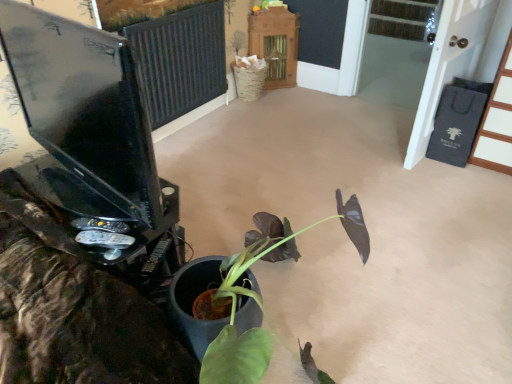
Question: Does wooden cabinet at upper center, arranged as the 2th furniture when viewed from the right, have a greater width compared to black fabric screen door at right?

Choices:
 (A) no
 (B) yes

Answer: (B)

Question: Is wooden cabinet at upper center, arranged as the 2th furniture when viewed from the right, positioned with its back to black fabric screen door at right?

Choices:
 (A) yes
 (B) no

Answer: (B)

Question: Is wooden cabinet at upper center, arranged as the first furniture when viewed from the left, behind black fabric screen door at right?

Choices:
 (A) no
 (B) yes

Answer: (B)

Question: Is wooden cabinet at upper center, arranged as the 2th furniture when viewed from the right, bigger than black fabric screen door at right?

Choices:
 (A) no
 (B) yes

Answer: (A)

Question: Is there a large distance between wooden cabinet at upper center, arranged as the 2th furniture when viewed from the right, and black fabric screen door at right?

Choices:
 (A) no
 (B) yes

Answer: (B)

Question: In the image, is matte black monitor at left positioned in front of or behind black fabric screen door at right?

Choices:
 (A) front
 (B) behind

Answer: (A)

Question: Considering the relative positions of matte black monitor at left and black fabric screen door at right in the image provided, is matte black monitor at left to the left or to the right of black fabric screen door at right?

Choices:
 (A) right
 (B) left

Answer: (B)

Question: From the image's perspective, is matte black monitor at left above or below black fabric screen door at right?

Choices:
 (A) below
 (B) above

Answer: (A)

Question: From a real-world perspective, is matte black monitor at left positioned above or below black fabric screen door at right?

Choices:
 (A) above
 (B) below

Answer: (A)

Question: From the image's perspective, is black wood door at upper right, placed as the second furniture when sorted from left to right, above or below wooden cabinet at upper center, arranged as the 2th furniture when viewed from the right?

Choices:
 (A) above
 (B) below

Answer: (B)

Question: Visually, is black wood door at upper right, the 1th furniture in the right-to-left sequence, positioned to the left or to the right of wooden cabinet at upper center, arranged as the 2th furniture when viewed from the right?

Choices:
 (A) right
 (B) left

Answer: (A)

Question: Is black wood door at upper right, the first furniture from the front, wider or thinner than wooden cabinet at upper center, arranged as the first furniture when viewed from the left?

Choices:
 (A) thin
 (B) wide

Answer: (B)

Question: Is point (505, 62) closer or farther from the camera than point (281, 24)?

Choices:
 (A) closer
 (B) farther

Answer: (A)

Question: Is black fabric screen door at right taller or shorter than matte black monitor at left?

Choices:
 (A) tall
 (B) short

Answer: (A)

Question: Is point (437, 41) positioned closer to the camera than point (94, 140)?

Choices:
 (A) closer
 (B) farther

Answer: (B)